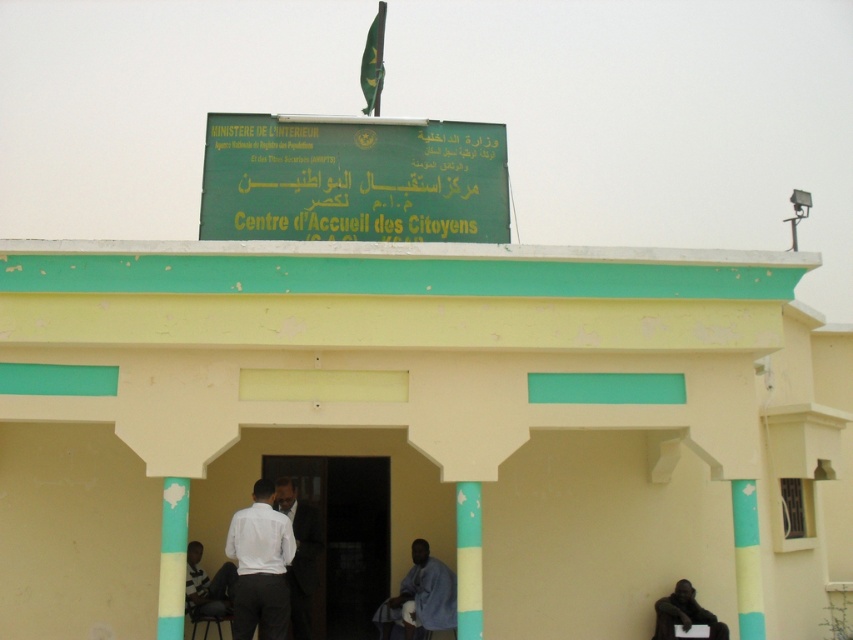
Question: Can you confirm if dark suit at center is positioned to the right of yellow painted pillar at center?

Choices:
 (A) yes
 (B) no

Answer: (B)

Question: Which point is closer to the camera?

Choices:
 (A) green matte signboard at center
 (B) dark suit at center

Answer: (A)

Question: Estimate the real-world distances between objects in this image. Which object is closer to the yellow painted pillar at center?

Choices:
 (A) white matte shirt at center
 (B) dark skin statue at lower right
 (C) blue fabric shirt at center

Answer: (A)

Question: Considering the relative positions of dark wood door at center and yellow painted pillar at center in the image provided, where is dark wood door at center located with respect to yellow painted pillar at center?

Choices:
 (A) left
 (B) right

Answer: (A)

Question: Does dark wood door at center appear under dark skin statue at lower right?

Choices:
 (A) no
 (B) yes

Answer: (A)

Question: Based on their relative distances, which object is farther from the blue fabric shirt at center?

Choices:
 (A) dark wood door at center
 (B) dark skin statue at lower right
 (C) white matte shirt at center
 (D) green matte signboard at center

Answer: (D)